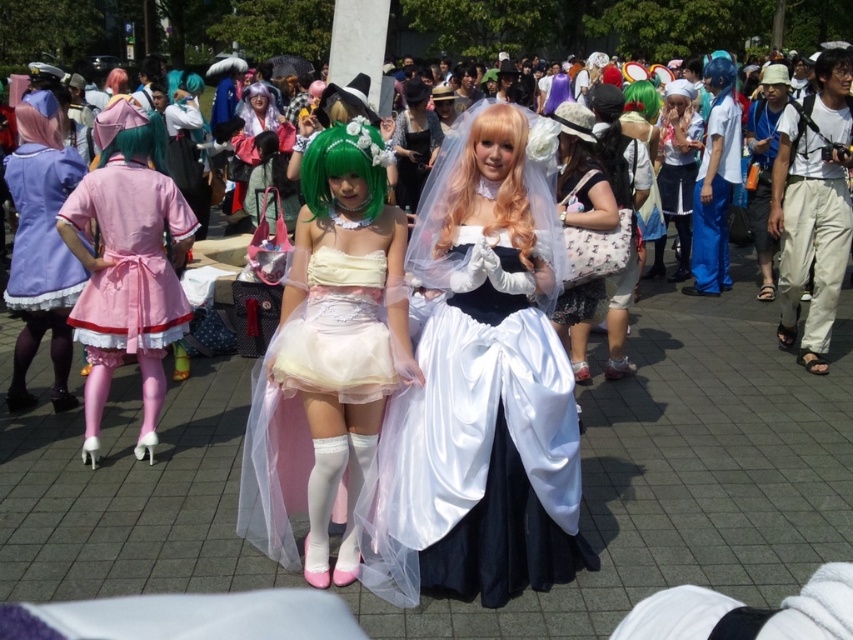
You are organizing a photoshoot at this event and need to position two models wearing the matte white tulle dress at center and the matte white dress at center. The camera you are using has a maximum focus range of 15 feet. Will you be able to capture both dresses clearly in a single shot without moving the camera?

The distance between the matte white tulle dress at center and the matte white dress at center is 16.71 feet, which exceeds the camera maximum focus range of 15 feet. Therefore, you will not be able to capture both dresses clearly in a single shot without moving the camera.

You are standing at the center of the park and want to reach the point marked at coordinates point (x=111, y=198). If you walk straight ahead, will you reach that point before walking 5 meters?

The distance of point (x=111, y=198) from viewer is 4.52 meters, so yes, you will reach the point before walking 5 meters.

You are a photographer at the event and want to position a prop at the exact center of the image. The matte white tulle dress at center is currently at point 0.559, 0.386. Is the dress already at the center of the image?

The matte white tulle dress at center is located at coordinate point (x=328, y=356). Since the exact center of an image is typically at (x=426, y=320), the dress is slightly to the right and below the true center.